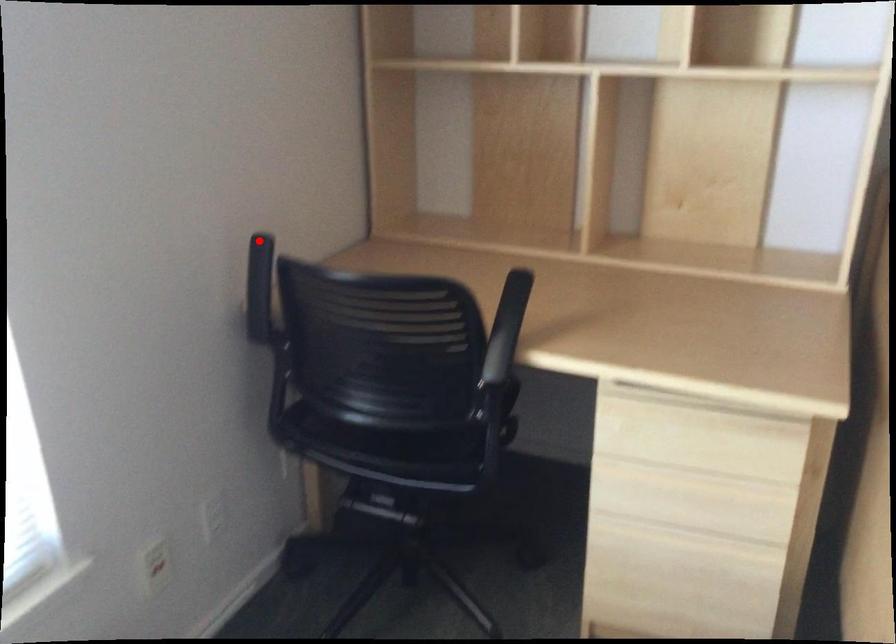
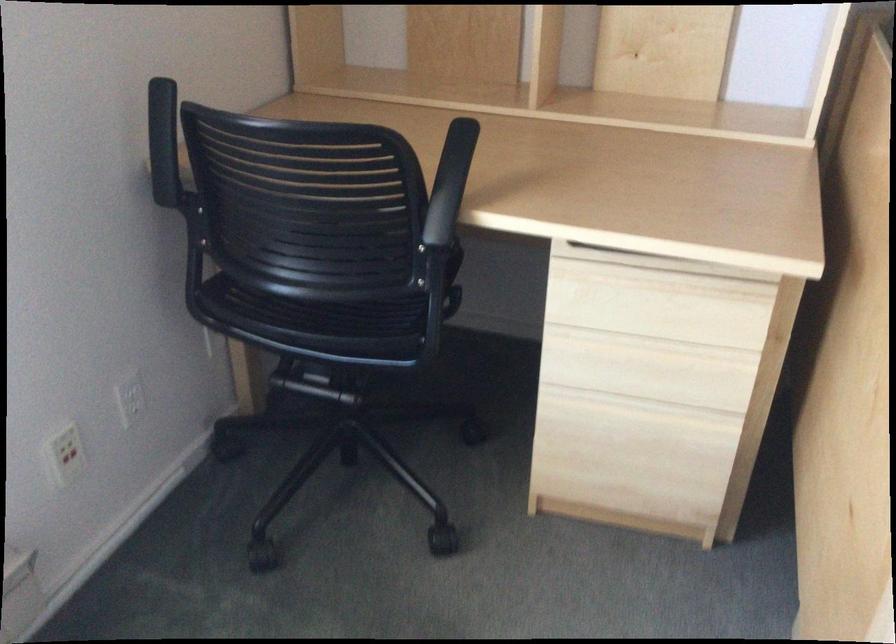
Question: I am providing you with two images of the same scene from different viewpoints. In image1, a red point is highlighted. Considering the same 3D point in image2, which of the following is correct?

Choices:
 (A) It is closer
 (B) It is farther

Answer: (A)